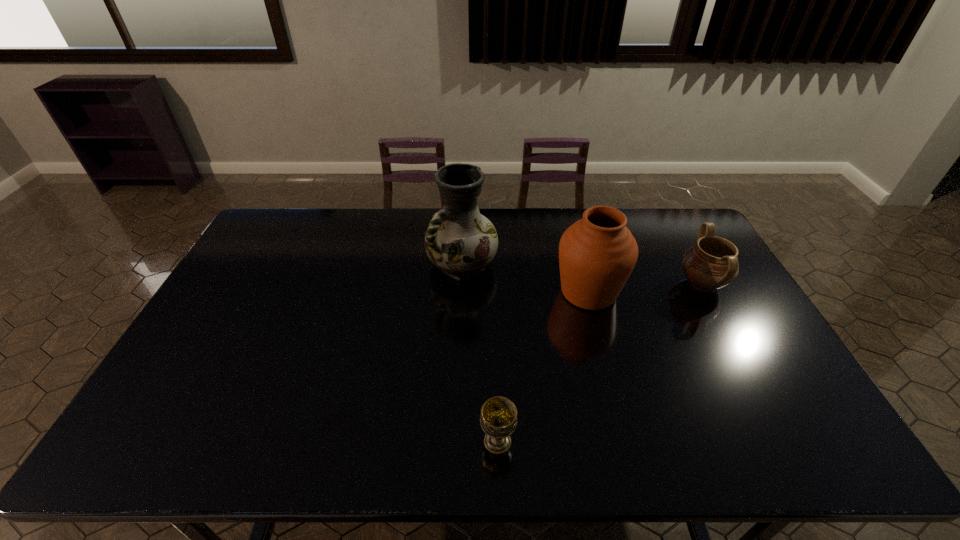
The image size is (960, 540). I want to click on the second closest object relative to the shorter urn, so click(x=460, y=241).

Find the location of `blank area in the image that satisfies the following two spatial constraints: 1. on the front-facing side of the shorter urn; 2. on the front side of the left urn`. blank area in the image that satisfies the following two spatial constraints: 1. on the front-facing side of the shorter urn; 2. on the front side of the left urn is located at coordinates (707, 292).